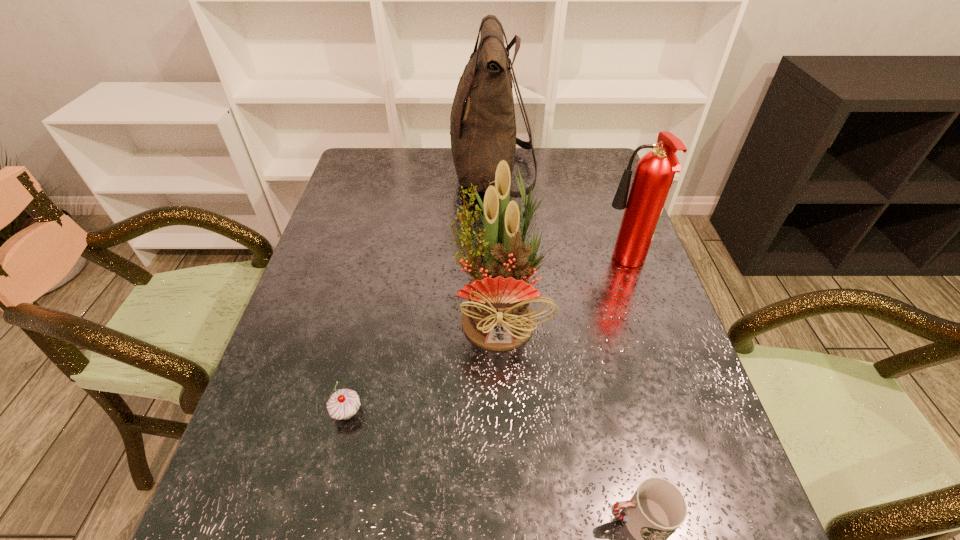
Locate an element on the screen. The image size is (960, 540). vacant space located at the nozzle of the rightmost object is located at coordinates (521, 264).

The height and width of the screenshot is (540, 960). Find the location of `free location located at the nozzle of the rightmost object`. free location located at the nozzle of the rightmost object is located at coordinates (460, 264).

Locate an element on the screen. Image resolution: width=960 pixels, height=540 pixels. vacant position located 0.300m at the nozzle of the rightmost object is located at coordinates (487, 264).

Where is `free space located 0.110m on the back of the cupcake`? This screenshot has height=540, width=960. free space located 0.110m on the back of the cupcake is located at coordinates (361, 352).

At what (x,y) coordinates should I click in order to perform the action: click on object positioned at the far edge. Please return your answer as a coordinate pair (x, y). Looking at the image, I should click on (482, 124).

Where is `object that is at the left edge`? object that is at the left edge is located at coordinates (344, 403).

Find the location of a particular element. The height and width of the screenshot is (540, 960). object at the right edge is located at coordinates (655, 171).

Where is `free space at the far edge`? The width and height of the screenshot is (960, 540). free space at the far edge is located at coordinates [x=547, y=166].

In the image, there is a desktop. Identify the location of vacant space at the left edge. (282, 376).

Image resolution: width=960 pixels, height=540 pixels. In the image, there is a desktop. Find the location of `vacant space at the right edge`. vacant space at the right edge is located at coordinates (612, 293).